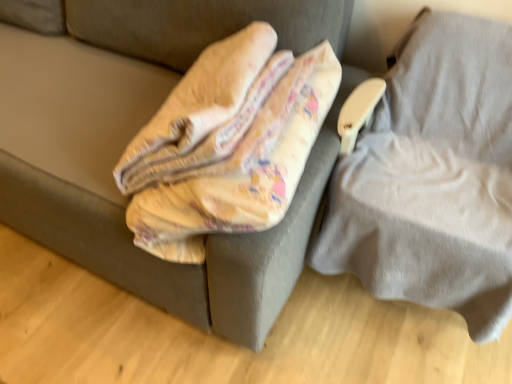
Where is `gray fabric pillow at right, which appears as the 1th furniture when viewed from the right`? gray fabric pillow at right, which appears as the 1th furniture when viewed from the right is located at coordinates (433, 178).

The height and width of the screenshot is (384, 512). Describe the element at coordinates (433, 178) in the screenshot. I see `gray fabric pillow at right, which appears as the 1th furniture when viewed from the right` at that location.

How much space does gray fabric pillow at right, which appears as the 1th furniture when viewed from the right, occupy vertically?

A: It is 73.60 centimeters.

Where is `yellow fabric blanket at upper left, the second furniture from the right`? yellow fabric blanket at upper left, the second furniture from the right is located at coordinates (178, 264).

Describe the element at coordinates (178, 264) in the screenshot. The width and height of the screenshot is (512, 384). I see `yellow fabric blanket at upper left, which is counted as the first furniture, starting from the left` at that location.

Where is `gray fabric pillow at right, marked as the 2th furniture in a left-to-right arrangement`? gray fabric pillow at right, marked as the 2th furniture in a left-to-right arrangement is located at coordinates (433, 178).

Between yellow fabric blanket at upper left, which is counted as the first furniture, starting from the left, and gray fabric pillow at right, which appears as the 1th furniture when viewed from the right, which one appears on the right side from the viewer's perspective?

From the viewer's perspective, gray fabric pillow at right, which appears as the 1th furniture when viewed from the right, appears more on the right side.

Which object is closer to the camera taking this photo, yellow fabric blanket at upper left, which is counted as the first furniture, starting from the left, or gray fabric pillow at right, marked as the 2th furniture in a left-to-right arrangement?

Positioned in front is gray fabric pillow at right, marked as the 2th furniture in a left-to-right arrangement.

Does point (118, 227) lie behind point (390, 155)?

No, (118, 227) is in front of (390, 155).

From the image's perspective, is yellow fabric blanket at upper left, which is counted as the first furniture, starting from the left, beneath gray fabric pillow at right, marked as the 2th furniture in a left-to-right arrangement?

Actually, yellow fabric blanket at upper left, which is counted as the first furniture, starting from the left, appears above gray fabric pillow at right, marked as the 2th furniture in a left-to-right arrangement, in the image.

From a real-world perspective, which is physically below, yellow fabric blanket at upper left, which is counted as the first furniture, starting from the left, or gray fabric pillow at right, which appears as the 1th furniture when viewed from the right?

gray fabric pillow at right, which appears as the 1th furniture when viewed from the right, is physically lower.

Considering the sizes of objects yellow fabric blanket at upper left, which is counted as the first furniture, starting from the left, and gray fabric pillow at right, marked as the 2th furniture in a left-to-right arrangement, in the image provided, who is thinner, yellow fabric blanket at upper left, which is counted as the first furniture, starting from the left, or gray fabric pillow at right, marked as the 2th furniture in a left-to-right arrangement,?

With smaller width is gray fabric pillow at right, marked as the 2th furniture in a left-to-right arrangement.

Does yellow fabric blanket at upper left, which is counted as the first furniture, starting from the left, have a lesser height compared to gray fabric pillow at right, marked as the 2th furniture in a left-to-right arrangement?

Correct, yellow fabric blanket at upper left, which is counted as the first furniture, starting from the left, is not as tall as gray fabric pillow at right, marked as the 2th furniture in a left-to-right arrangement.

Considering the sizes of yellow fabric blanket at upper left, the second furniture from the right, and gray fabric pillow at right, marked as the 2th furniture in a left-to-right arrangement, in the image, is yellow fabric blanket at upper left, the second furniture from the right, bigger or smaller than gray fabric pillow at right, marked as the 2th furniture in a left-to-right arrangement,?

Considering their sizes, yellow fabric blanket at upper left, the second furniture from the right, takes up less space than gray fabric pillow at right, marked as the 2th furniture in a left-to-right arrangement.

Which is correct: yellow fabric blanket at upper left, which is counted as the first furniture, starting from the left, is inside gray fabric pillow at right, which appears as the 1th furniture when viewed from the right, or outside of it?

yellow fabric blanket at upper left, which is counted as the first furniture, starting from the left, is spatially situated outside gray fabric pillow at right, which appears as the 1th furniture when viewed from the right.

Would you say yellow fabric blanket at upper left, the second furniture from the right, is a long distance from gray fabric pillow at right, which appears as the 1th furniture when viewed from the right?

Actually, yellow fabric blanket at upper left, the second furniture from the right, and gray fabric pillow at right, which appears as the 1th furniture when viewed from the right, are a little close together.

Is yellow fabric blanket at upper left, the second furniture from the right, oriented away from gray fabric pillow at right, which appears as the 1th furniture when viewed from the right?

No, yellow fabric blanket at upper left, the second furniture from the right, is not facing the opposite direction of gray fabric pillow at right, which appears as the 1th furniture when viewed from the right.

How far apart are yellow fabric blanket at upper left, which is counted as the first furniture, starting from the left, and gray fabric pillow at right, marked as the 2th furniture in a left-to-right arrangement?

yellow fabric blanket at upper left, which is counted as the first furniture, starting from the left, and gray fabric pillow at right, marked as the 2th furniture in a left-to-right arrangement, are 15.03 inches apart from each other.

At what (x,y) coordinates should I click in order to perform the action: click on furniture above the gray fabric pillow at right, marked as the 2th furniture in a left-to-right arrangement (from a real-world perspective). Please return your answer as a coordinate pair (x, y). Looking at the image, I should click on (178, 264).

Is gray fabric pillow at right, which appears as the 1th furniture when viewed from the right, at the right side of yellow fabric blanket at upper left, the second furniture from the right?

Correct, you'll find gray fabric pillow at right, which appears as the 1th furniture when viewed from the right, to the right of yellow fabric blanket at upper left, the second furniture from the right.

Does gray fabric pillow at right, which appears as the 1th furniture when viewed from the right, lie in front of yellow fabric blanket at upper left, which is counted as the first furniture, starting from the left?

Yes, it is in front of yellow fabric blanket at upper left, which is counted as the first furniture, starting from the left.

Which is behind, point (462, 215) or point (113, 271)?

The point (113, 271) is farther from the camera.

From the image's perspective, is gray fabric pillow at right, marked as the 2th furniture in a left-to-right arrangement, positioned above or below yellow fabric blanket at upper left, which is counted as the first furniture, starting from the left?

From the image's perspective, gray fabric pillow at right, marked as the 2th furniture in a left-to-right arrangement, appears below yellow fabric blanket at upper left, which is counted as the first furniture, starting from the left.

From a real-world perspective, relative to yellow fabric blanket at upper left, which is counted as the first furniture, starting from the left, is gray fabric pillow at right, marked as the 2th furniture in a left-to-right arrangement, vertically above or below?

Clearly, from a real-world perspective, gray fabric pillow at right, marked as the 2th furniture in a left-to-right arrangement, is below yellow fabric blanket at upper left, which is counted as the first furniture, starting from the left.

Which object is wider, gray fabric pillow at right, which appears as the 1th furniture when viewed from the right, or yellow fabric blanket at upper left, which is counted as the first furniture, starting from the left?

yellow fabric blanket at upper left, which is counted as the first furniture, starting from the left.

Which of these two, gray fabric pillow at right, which appears as the 1th furniture when viewed from the right, or yellow fabric blanket at upper left, which is counted as the first furniture, starting from the left, stands taller?

Standing taller between the two is gray fabric pillow at right, which appears as the 1th furniture when viewed from the right.

Who is bigger, gray fabric pillow at right, marked as the 2th furniture in a left-to-right arrangement, or yellow fabric blanket at upper left, which is counted as the first furniture, starting from the left?

gray fabric pillow at right, marked as the 2th furniture in a left-to-right arrangement, is bigger.

Is gray fabric pillow at right, which appears as the 1th furniture when viewed from the right, completely or partially outside of yellow fabric blanket at upper left, which is counted as the first furniture, starting from the left?

Indeed, gray fabric pillow at right, which appears as the 1th furniture when viewed from the right, is completely outside yellow fabric blanket at upper left, which is counted as the first furniture, starting from the left.

Are gray fabric pillow at right, marked as the 2th furniture in a left-to-right arrangement, and yellow fabric blanket at upper left, which is counted as the first furniture, starting from the left, far apart?

gray fabric pillow at right, marked as the 2th furniture in a left-to-right arrangement, is actually quite close to yellow fabric blanket at upper left, which is counted as the first furniture, starting from the left.

Could you tell me if gray fabric pillow at right, which appears as the 1th furniture when viewed from the right, is turned towards yellow fabric blanket at upper left, which is counted as the first furniture, starting from the left?

Yes, gray fabric pillow at right, which appears as the 1th furniture when viewed from the right, faces towards yellow fabric blanket at upper left, which is counted as the first furniture, starting from the left.

At what (x,y) coordinates should I click in order to perform the action: click on furniture in front of the yellow fabric blanket at upper left, the second furniture from the right. Please return your answer as a coordinate pair (x, y). Looking at the image, I should click on (433, 178).

Where is `furniture that is in front of the yellow fabric blanket at upper left, the second furniture from the right`? This screenshot has height=384, width=512. furniture that is in front of the yellow fabric blanket at upper left, the second furniture from the right is located at coordinates (433, 178).

Find the location of a particular element. furniture beneath the yellow fabric blanket at upper left, which is counted as the first furniture, starting from the left (from a real-world perspective) is located at coordinates (433, 178).